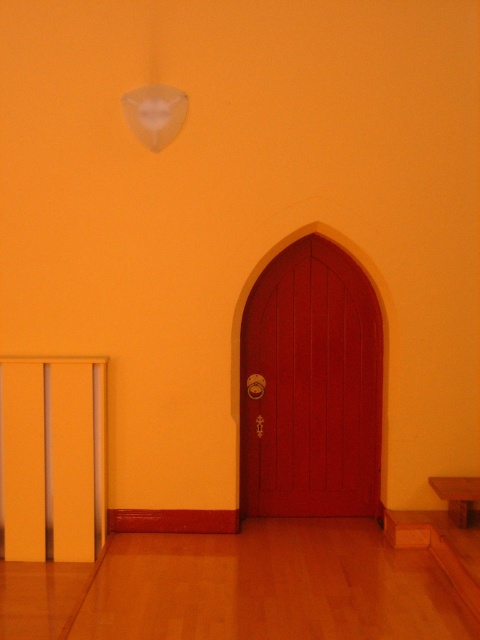
Does matte wood door at center have a smaller size compared to brown wooden church bench at lower right?

Incorrect, matte wood door at center is not smaller in size than brown wooden church bench at lower right.

Is matte wood door at center closer to camera compared to brown wooden church bench at lower right?

No.

Between point (289, 504) and point (456, 484), which one is positioned in front?

Positioned in front is point (456, 484).

At what (x,y) coordinates should I click in order to perform the action: click on matte wood door at center. Please return your answer as a coordinate pair (x, y). Looking at the image, I should click on (311, 387).